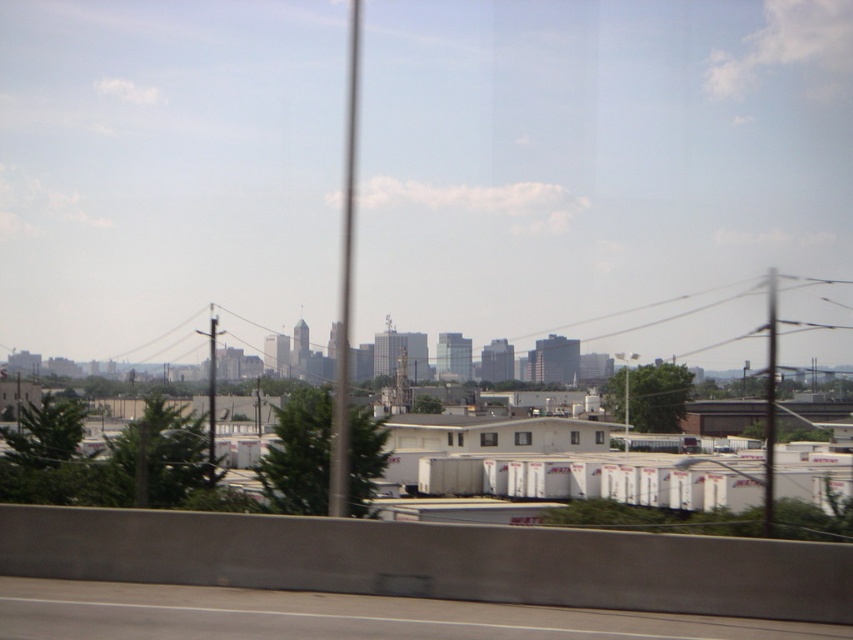
Question: Which point is closer to the camera taking this photo?

Choices:
 (A) (349, 56)
 (B) (770, 500)

Answer: (B)

Question: From the image, what is the correct spatial relationship of gray asphalt highway at lower center in relation to metallic pole at center?

Choices:
 (A) left
 (B) right

Answer: (B)

Question: Which object appears closest to the camera in this image?

Choices:
 (A) metallic pole at center
 (B) gray asphalt highway at lower center

Answer: (B)

Question: Can you confirm if metallic pole at center is positioned to the left of metallic pole at right?

Choices:
 (A) yes
 (B) no

Answer: (A)

Question: Among these points, which one is farthest from the camera?

Choices:
 (A) pyautogui.click(x=763, y=525)
 (B) pyautogui.click(x=254, y=605)
 (C) pyautogui.click(x=357, y=0)

Answer: (C)

Question: Is metallic pole at center further to camera compared to metallic pole at right?

Choices:
 (A) no
 (B) yes

Answer: (A)